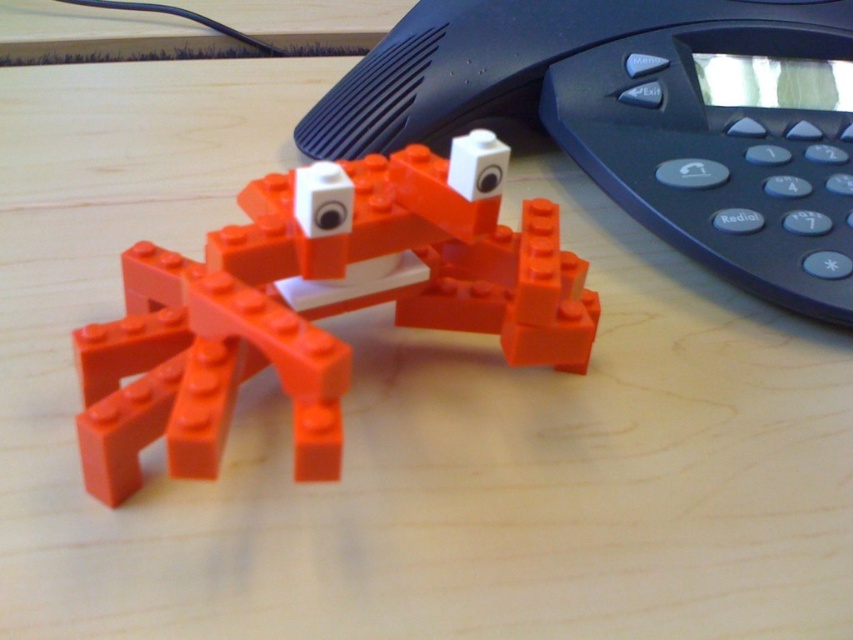
Question: Can you confirm if black plastic phone at upper center is smaller than orange matte plastic crab at center?

Choices:
 (A) no
 (B) yes

Answer: (A)

Question: From the image, what is the correct spatial relationship of black plastic phone at upper center in relation to orange matte plastic crab at center?

Choices:
 (A) left
 (B) right

Answer: (B)

Question: Among these objects, which one is nearest to the camera?

Choices:
 (A) orange matte plastic crab at center
 (B) black plastic phone at upper center

Answer: (A)

Question: Where is black plastic phone at upper center located in relation to orange matte plastic crab at center in the image?

Choices:
 (A) left
 (B) right

Answer: (B)

Question: Which object appears closest to the camera in this image?

Choices:
 (A) black plastic phone at upper center
 (B) orange matte plastic crab at center

Answer: (B)